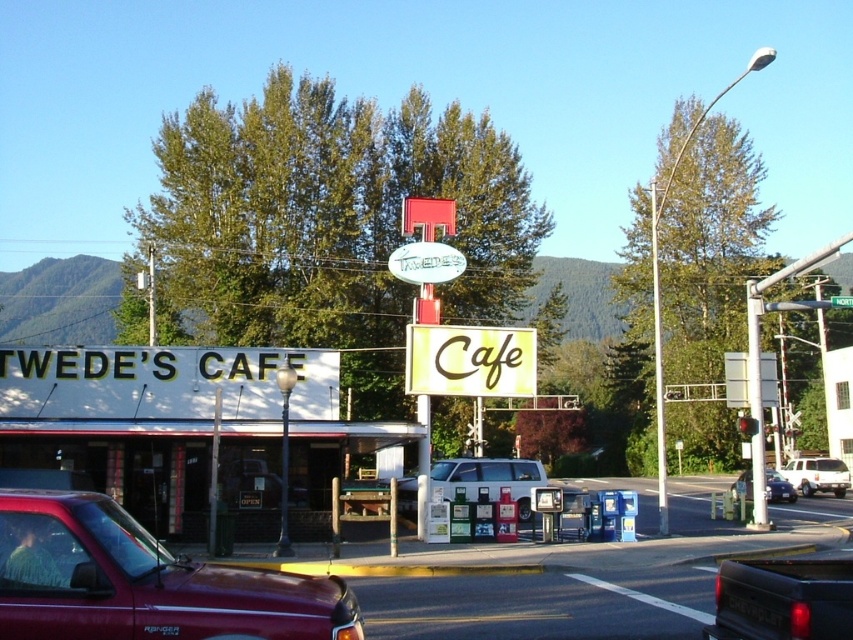
You are standing at the entrance of the cafe and want to find the white matte signboard at center. According to the coordinates provided, in which direction should you look to see it?

The white matte signboard at center is located at coordinates point (181, 422), which would be to the upper right direction from your current position at the entrance.

You are a delivery driver who needs to park a new vehicle between the white matte suv at center and the silver metallic sedan at center. Based on the scene, can you determine if there is enough space between them for your vehicle which is 1.8 meters wide?

The white matte suv at center is narrower than the silver metallic sedan at center. However, the exact distance between them isn not provided, so we cannot confirm if there is enough space for a 1.8 meter wide vehicle.